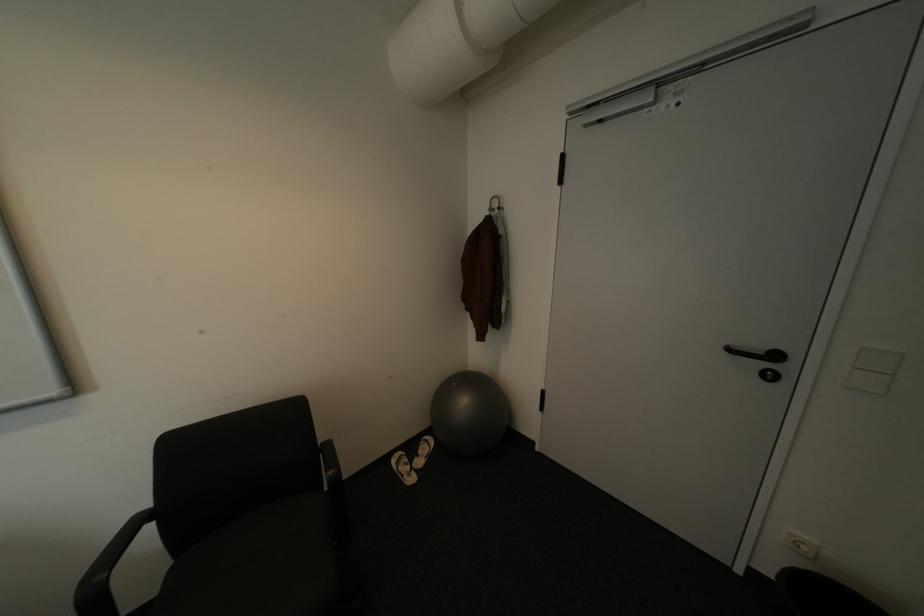
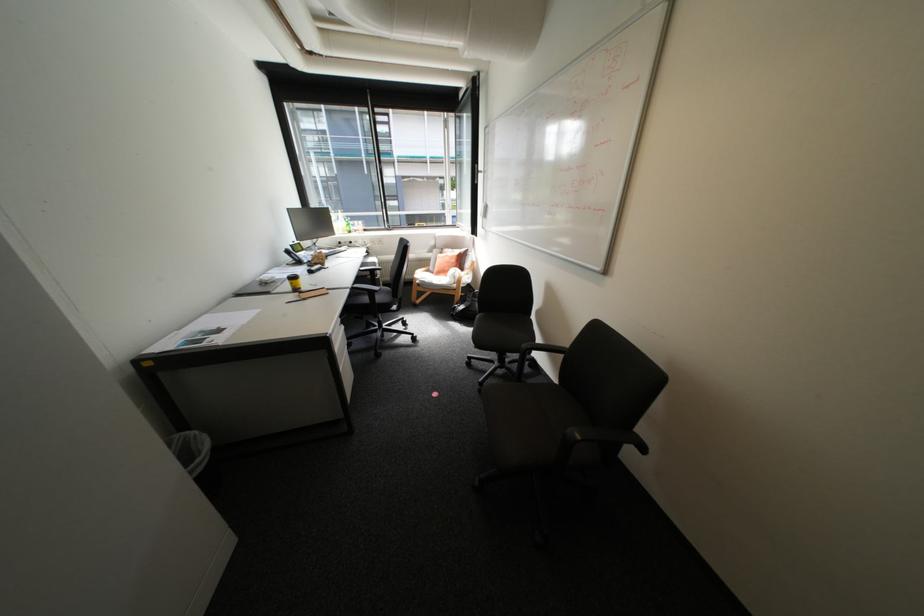
Find the pixel in the second image that matches (116,575) in the first image.

(539, 347)